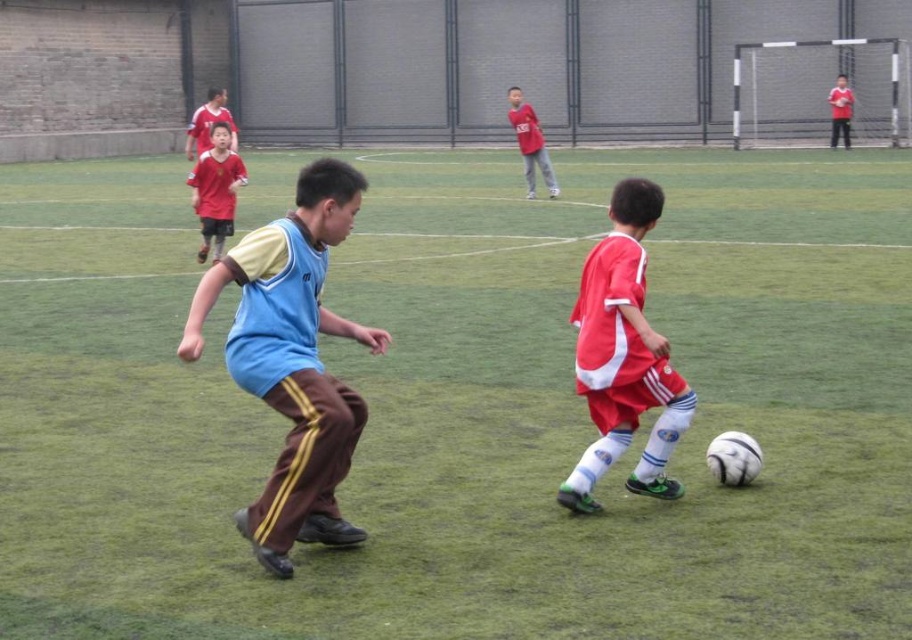
Describe the element at coordinates (623, 356) in the screenshot. This screenshot has width=912, height=640. I see `red matte soccer player at center` at that location.

Between point (657, 211) and point (198, 118), which one is positioned behind?

Point (198, 118)

Locate an element on the screen. Image resolution: width=912 pixels, height=640 pixels. red matte soccer player at center is located at coordinates (623, 356).

Consider the image. Who is higher up, red matte soccer player at center or red matte shirt at center?

Positioned higher is red matte shirt at center.

Does point (588, 467) come closer to viewer compared to point (520, 138)?

Yes, point (588, 467) is in front of point (520, 138).

Is point (637, 179) positioned after point (514, 120)?

No, it is not.

I want to click on red matte soccer player at center, so click(x=623, y=356).

Is matte red jersey at center to the right of matte blue shirt at upper center from the viewer's perspective?

Correct, you'll find matte red jersey at center to the right of matte blue shirt at upper center.

I want to click on matte red jersey at center, so click(x=215, y=189).

You are a GUI agent. You are given a task and a screenshot of the screen. Output one action in this format:
    pyautogui.click(x=<x>, y=<y>)
    Task: Click on the matte red jersey at center
    
    Given the screenshot: What is the action you would take?
    pyautogui.click(x=215, y=189)